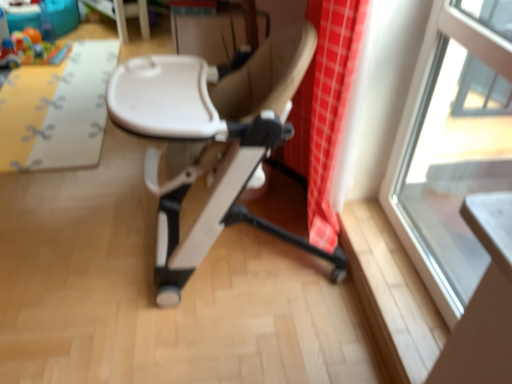
Find the location of a particular element. The image size is (512, 384). white glossy table at upper center is located at coordinates (124, 15).

What do you see at coordinates (57, 110) in the screenshot?
I see `yellow fabric mat at upper left` at bounding box center [57, 110].

Describe the element at coordinates (30, 50) in the screenshot. Image resolution: width=512 pixels, height=384 pixels. I see `rubberized plastic toy at upper left` at that location.

Where is `white glossy table at upper center`? The width and height of the screenshot is (512, 384). white glossy table at upper center is located at coordinates (124, 15).

Is rubberized plastic toy at upper left situated inside white glossy table at upper center or outside?

rubberized plastic toy at upper left exists outside the volume of white glossy table at upper center.

Does rubberized plastic toy at upper left have a greater width compared to white glossy table at upper center?

Correct, the width of rubberized plastic toy at upper left exceeds that of white glossy table at upper center.

Is rubberized plastic toy at upper left bigger than white glossy table at upper center?

No.

Is rubberized plastic toy at upper left aimed at white glossy table at upper center?

No, rubberized plastic toy at upper left is not oriented towards white glossy table at upper center.

Can you see transparent glass window at upper right touching rubberized plastic toy at upper left?

No, transparent glass window at upper right is not with rubberized plastic toy at upper left.

Looking at this image, is rubberized plastic toy at upper left inside transparent glass window at upper right?

Actually, rubberized plastic toy at upper left is outside transparent glass window at upper right.

From the image's perspective, which is below, transparent glass window at upper right or rubberized plastic toy at upper left?

transparent glass window at upper right appears lower in the image.

Can you confirm if transparent glass window at upper right is shorter than rubberized plastic toy at upper left?

No.

Between white glossy table at upper center and transparent glass window at upper right, which one is positioned behind?

Positioned behind is white glossy table at upper center.

From a real-world perspective, which is physically above, white glossy table at upper center or transparent glass window at upper right?

transparent glass window at upper right.

From the picture: Between white glossy table at upper center and transparent glass window at upper right, which one appears on the left side from the viewer's perspective?

Positioned to the left is white glossy table at upper center.

From the picture: Considering the relative sizes of white glossy table at upper center and transparent glass window at upper right in the image provided, is white glossy table at upper center wider than transparent glass window at upper right?

Indeed, white glossy table at upper center has a greater width compared to transparent glass window at upper right.

Is rubberized plastic toy at upper left at the back of yellow fabric mat at upper left?

Absolutely, yellow fabric mat at upper left is directed away from rubberized plastic toy at upper left.

Are yellow fabric mat at upper left and rubberized plastic toy at upper left beside each other?

yellow fabric mat at upper left and rubberized plastic toy at upper left are not in contact.

Considering the relative sizes of yellow fabric mat at upper left and rubberized plastic toy at upper left in the image provided, is yellow fabric mat at upper left shorter than rubberized plastic toy at upper left?

Correct, yellow fabric mat at upper left is not as tall as rubberized plastic toy at upper left.

Does yellow fabric mat at upper left have a lesser width compared to rubberized plastic toy at upper left?

No, yellow fabric mat at upper left is not thinner than rubberized plastic toy at upper left.

Is rubberized plastic toy at upper left aimed at transparent glass window at upper right?

No, rubberized plastic toy at upper left does not turn towards transparent glass window at upper right.

Based on their sizes in the image, would you say rubberized plastic toy at upper left is bigger or smaller than transparent glass window at upper right?

rubberized plastic toy at upper left is smaller than transparent glass window at upper right.

Is rubberized plastic toy at upper left positioned far away from transparent glass window at upper right?

Indeed, rubberized plastic toy at upper left is not near transparent glass window at upper right.

This screenshot has height=384, width=512. I want to click on toy on the left of the transparent glass window at upper right, so click(x=30, y=50).

Is transparent glass window at upper right taller or shorter than yellow fabric mat at upper left?

In the image, transparent glass window at upper right appears to be taller than yellow fabric mat at upper left.

From a real-world perspective, is transparent glass window at upper right located beneath yellow fabric mat at upper left?

Incorrect, from a real-world perspective, transparent glass window at upper right is higher than yellow fabric mat at upper left.

Between beige leather chair at center and white glossy table at upper center, which one has smaller width?

white glossy table at upper center.

In the scene shown: Between beige leather chair at center and white glossy table at upper center, which one appears on the left side from the viewer's perspective?

white glossy table at upper center.

Does beige leather chair at center have a smaller size compared to white glossy table at upper center?

Incorrect, beige leather chair at center is not smaller in size than white glossy table at upper center.

Locate an element on the screen. table lying behind the rubberized plastic toy at upper left is located at coordinates (124, 15).

This screenshot has height=384, width=512. Find the location of `toy to the left of transparent glass window at upper right`. toy to the left of transparent glass window at upper right is located at coordinates (30, 50).

Considering their positions, is beige leather chair at center positioned further to yellow fabric mat at upper left than transparent glass window at upper right?

transparent glass window at upper right.

Which object lies nearer to the anchor point beige leather chair at center, white glossy table at upper center or yellow fabric mat at upper left?

yellow fabric mat at upper left.

Considering their positions, is transparent glass window at upper right positioned further to rubberized plastic toy at upper left than white glossy table at upper center?

The object further to rubberized plastic toy at upper left is transparent glass window at upper right.

Considering their positions, is beige leather chair at center positioned closer to rubberized plastic toy at upper left than white glossy table at upper center?

The object closer to rubberized plastic toy at upper left is white glossy table at upper center.

Considering their positions, is white glossy table at upper center positioned further to rubberized plastic toy at upper left than transparent glass window at upper right?

Among the two, transparent glass window at upper right is located further to rubberized plastic toy at upper left.

Considering their positions, is transparent glass window at upper right positioned further to rubberized plastic toy at upper left than beige leather chair at center?

Among the two, transparent glass window at upper right is located further to rubberized plastic toy at upper left.

Based on their spatial positions, is white glossy table at upper center or rubberized plastic toy at upper left closer to transparent glass window at upper right?

Among the two, white glossy table at upper center is located nearer to transparent glass window at upper right.

In the scene shown: Estimate the real-world distances between objects in this image. Which object is closer to beige leather chair at center, rubberized plastic toy at upper left or transparent glass window at upper right?

transparent glass window at upper right lies closer to beige leather chair at center than the other object.

Identify the location of toy positioned between beige leather chair at center and white glossy table at upper center from near to far. Image resolution: width=512 pixels, height=384 pixels. (30, 50).

Locate an element on the screen. This screenshot has width=512, height=384. mat between beige leather chair at center and white glossy table at upper center along the z-axis is located at coordinates (57, 110).

The image size is (512, 384). I want to click on toy located between yellow fabric mat at upper left and white glossy table at upper center in the depth direction, so click(30, 50).

The image size is (512, 384). In order to click on chair between transparent glass window at upper right and white glossy table at upper center in the front-back direction in this screenshot , I will do `click(213, 140)`.